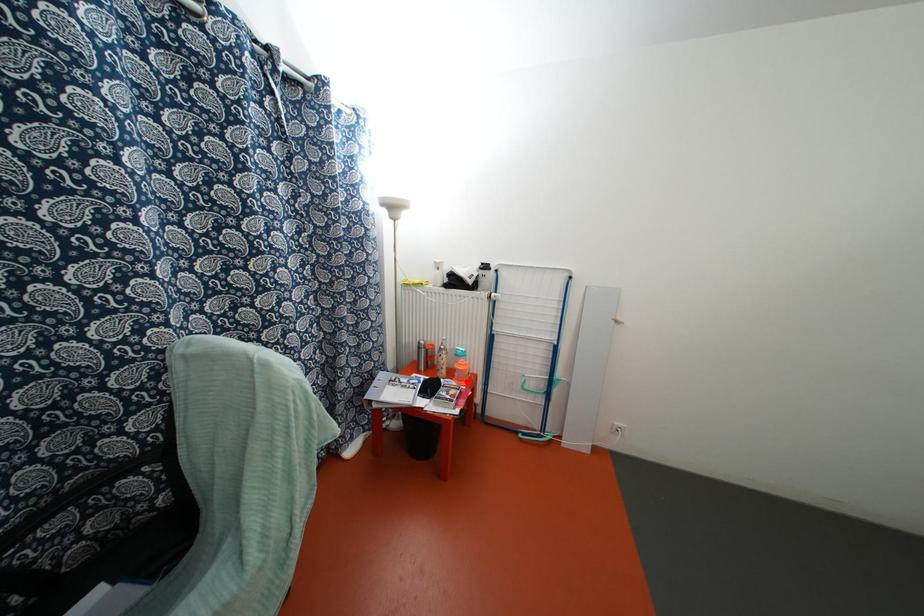
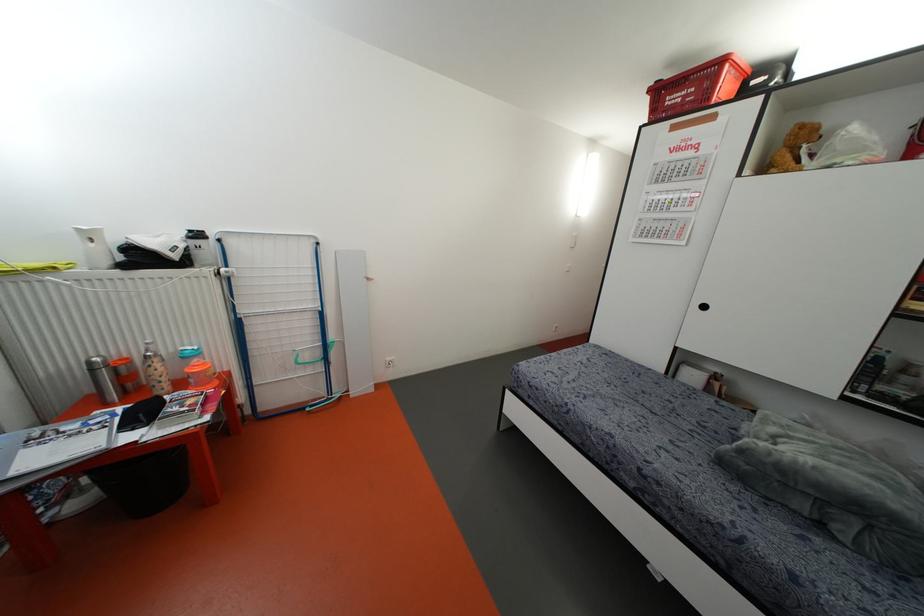
In the second image, find the point that corresponds to the highlighted location in the first image.

(215, 383)